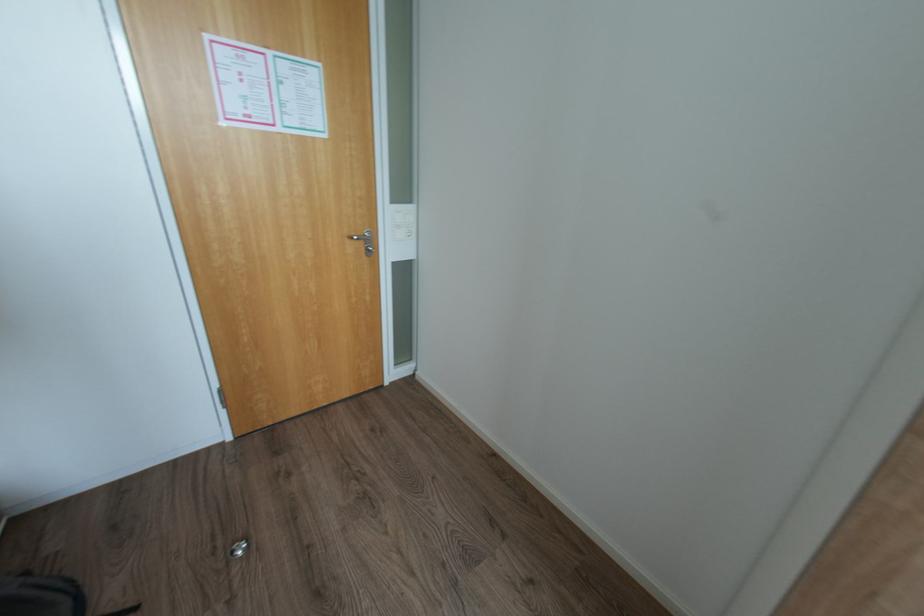
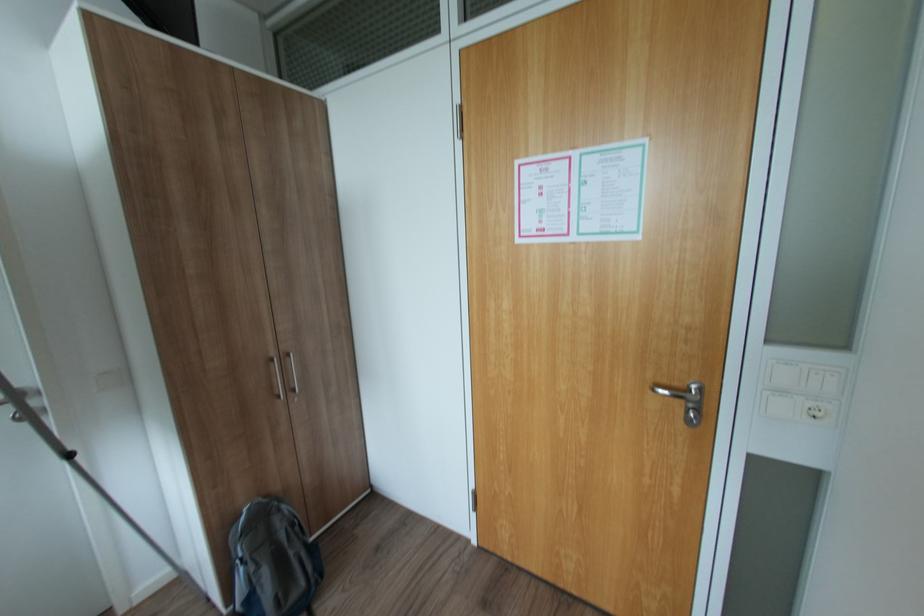
Question: The camera is either moving clockwise (left) or counter-clockwise (right) around the object. The first image is from the beginning of the video and the second image is from the end. Is the camera moving left or right when shooting the video?

Choices:
 (A) Left
 (B) Right

Answer: (B)